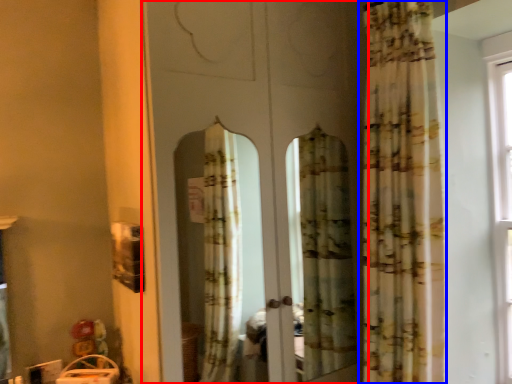
Question: Which object appears closest to the camera in this image, screen door (highlighted by a red box) or curtain (highlighted by a blue box)?

Choices:
 (A) screen door
 (B) curtain

Answer: (A)